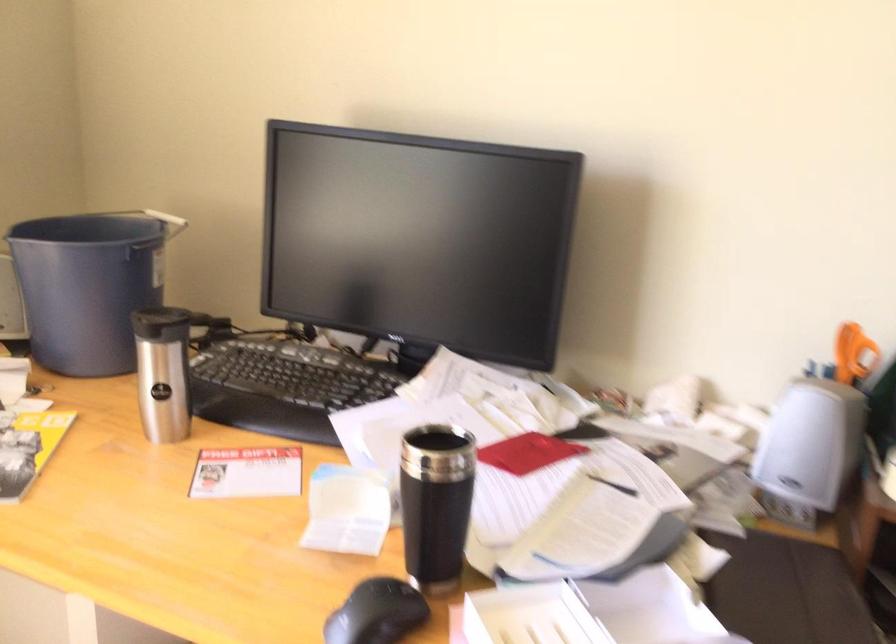
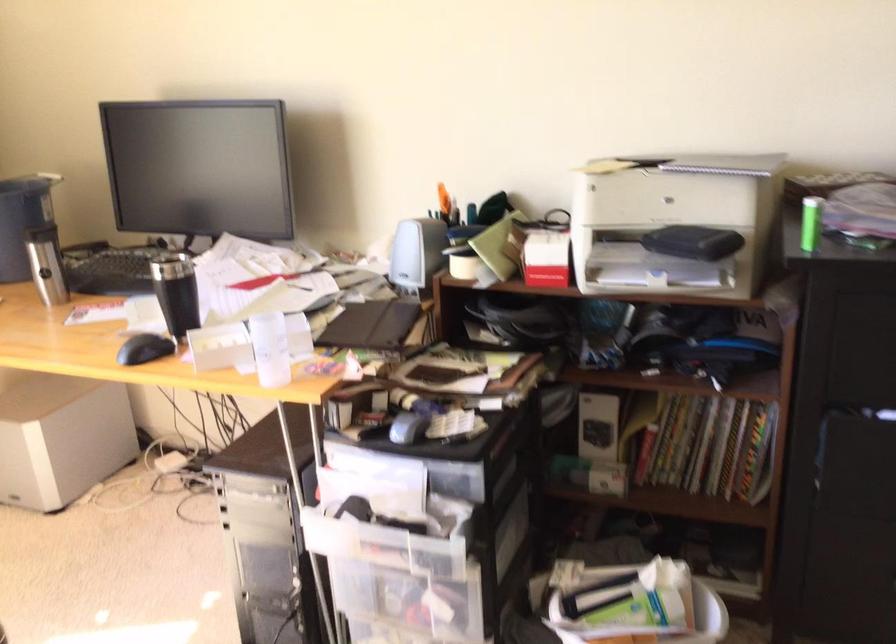
In the second image, find the point that corresponds to point 122,289 in the first image.

(22, 220)